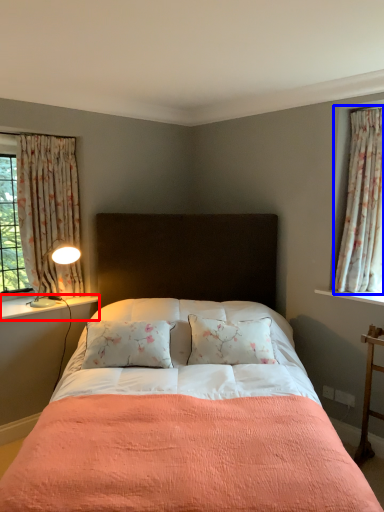
Question: Which point is further to the camera, window sill (highlighted by a red box) or curtain (highlighted by a blue box)?

Choices:
 (A) window sill
 (B) curtain

Answer: (A)